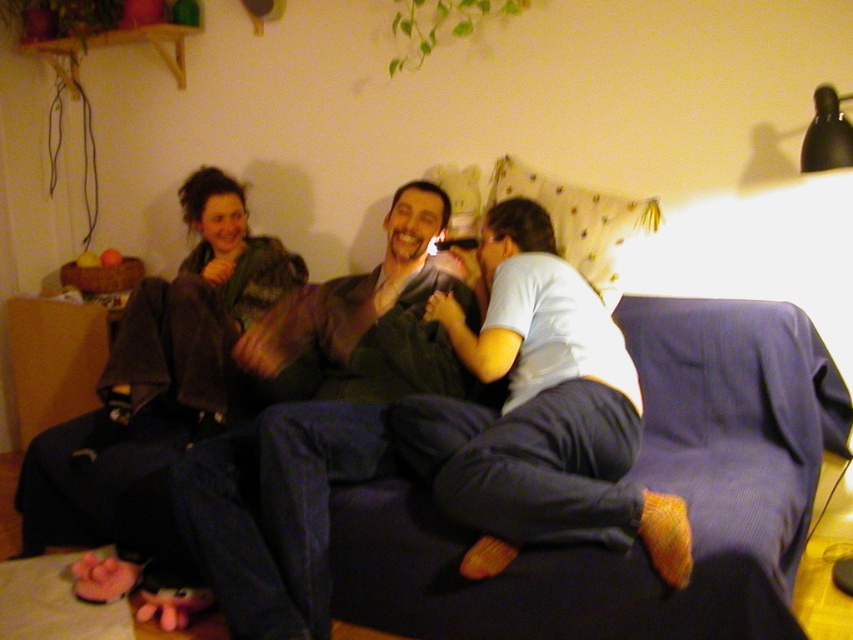
What are the coordinates of `blue corduroy couch at center` in the screenshot? It's located at (647, 484).

Does point (646, 348) lie in front of point (219, 454)?

No, (646, 348) is further to viewer.

The height and width of the screenshot is (640, 853). What are the coordinates of `blue corduroy couch at center` in the screenshot? It's located at (647, 484).